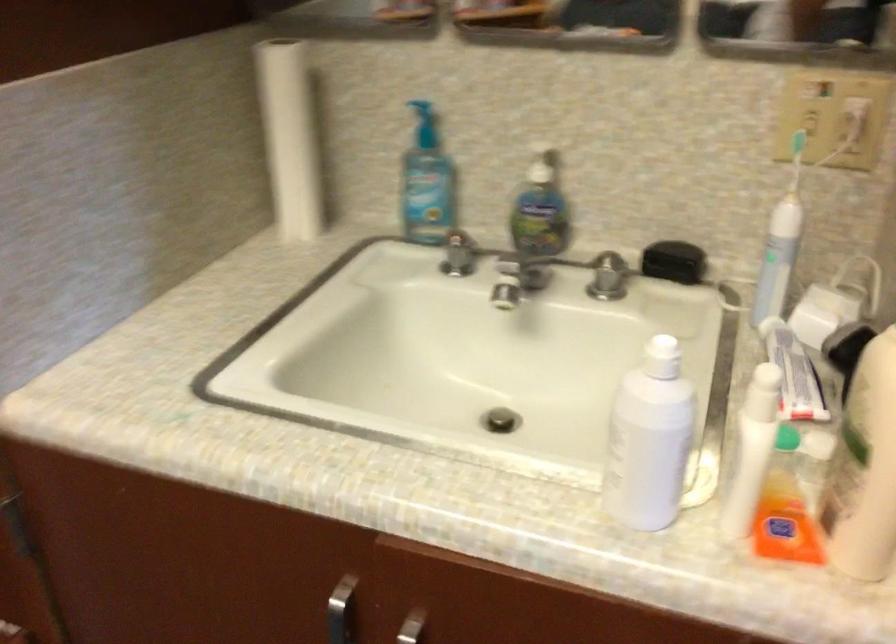
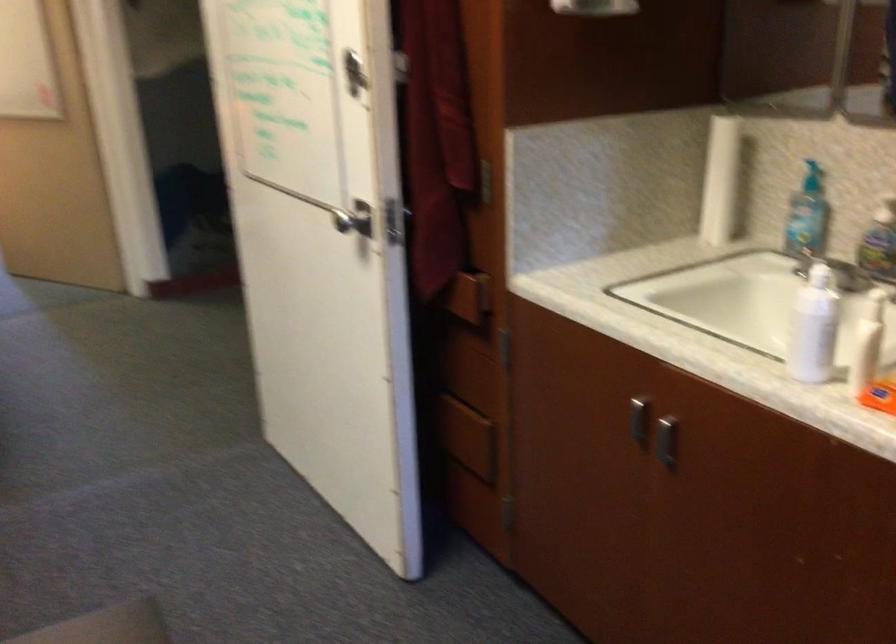
Question: The images are taken continuously from a first-person perspective. In which direction is your viewpoint rotating?

Choices:
 (A) Left
 (B) Right
 (C) Up
 (D) Down

Answer: (A)